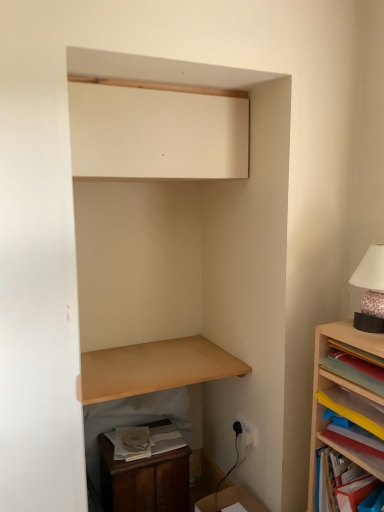
I want to click on free spot above light brown wood shelf at lower center, acting as the first shelf starting from the left (from a real-world perspective), so click(159, 357).